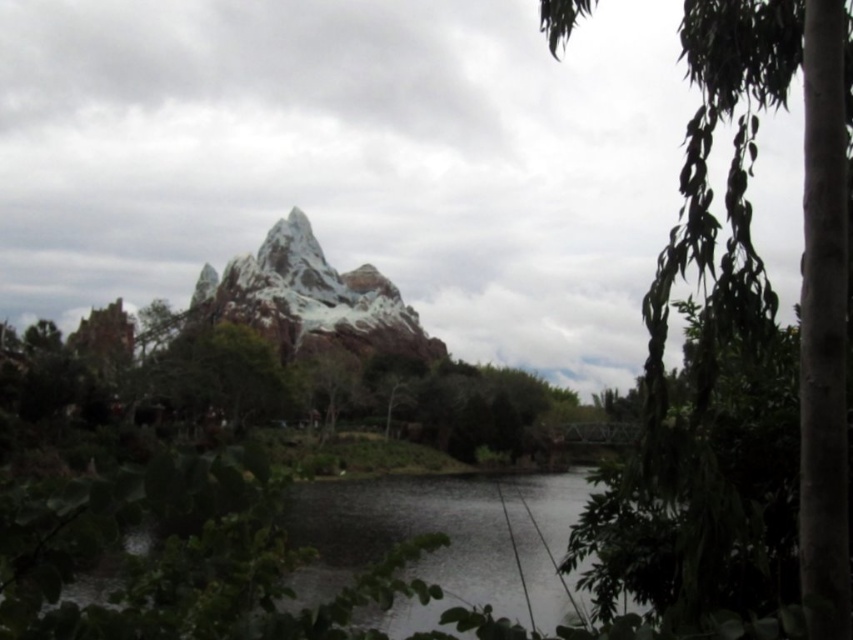
Question: Which object is positioned farthest from the dark reflective water at center?

Choices:
 (A) green leafy tree at right
 (B) snowy rock mountain at center

Answer: (B)

Question: Can you confirm if green leafy tree at right is positioned below dark reflective water at center?

Choices:
 (A) no
 (B) yes

Answer: (A)

Question: Which of the following is the farthest from the observer?

Choices:
 (A) dark reflective water at center
 (B) snowy rock mountain at center
 (C) green leafy tree at right

Answer: (B)

Question: Does green leafy tree at right have a lesser width compared to dark reflective water at center?

Choices:
 (A) no
 (B) yes

Answer: (B)

Question: Which point is farther from the camera taking this photo?

Choices:
 (A) (705, 192)
 (B) (315, 330)
 (C) (531, 525)

Answer: (B)

Question: Does green leafy tree at right appear on the left side of snowy rock mountain at center?

Choices:
 (A) no
 (B) yes

Answer: (A)